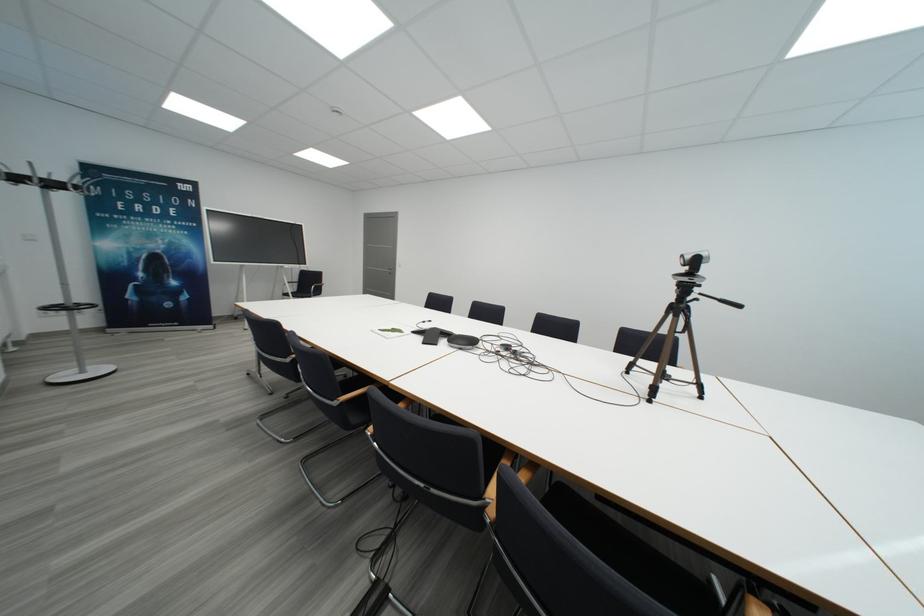
Where would you resting arm the wooden chair armrest? Please return your answer as a coordinate pair (x, y).

(493, 485)